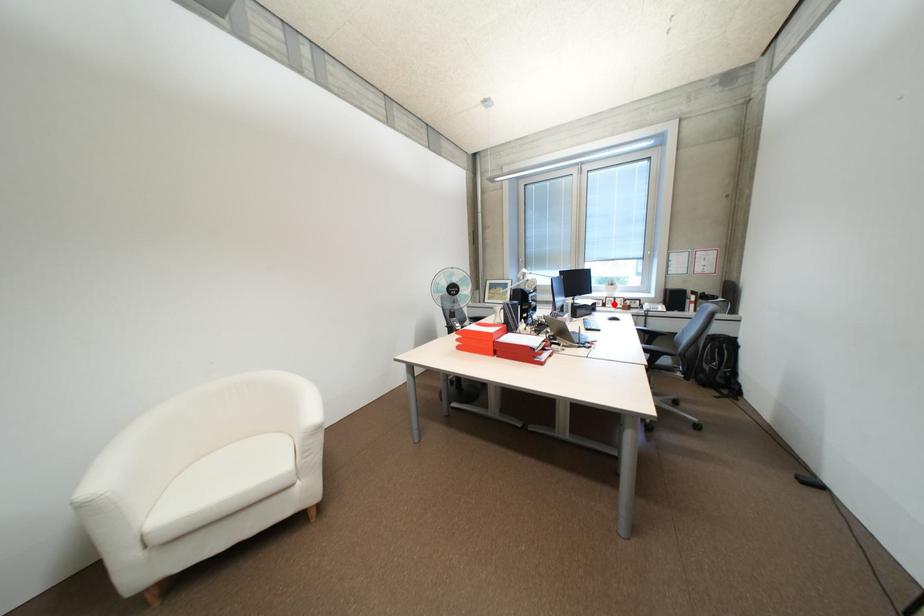
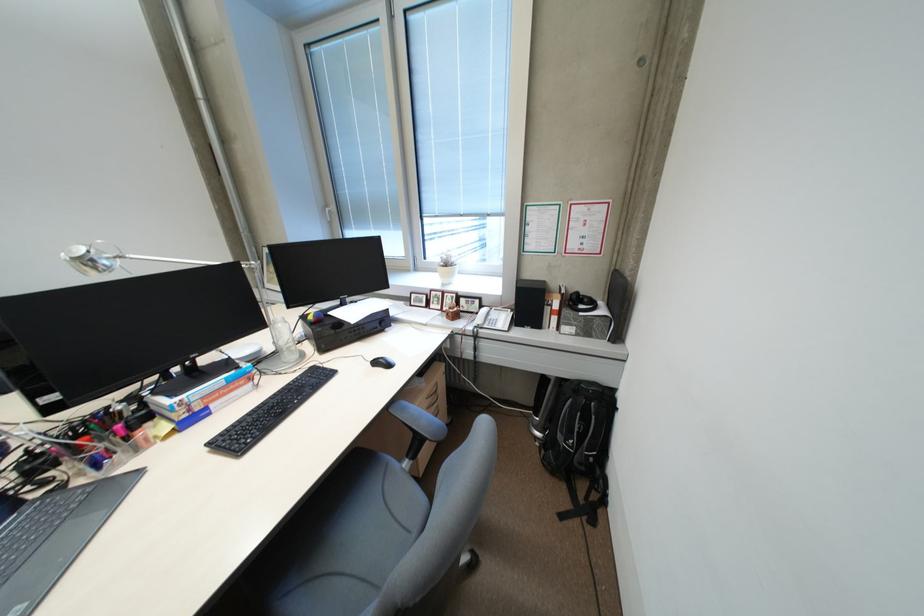
Where in the second image is the point corresponding to the highlighted location from the first image?

(438, 304)